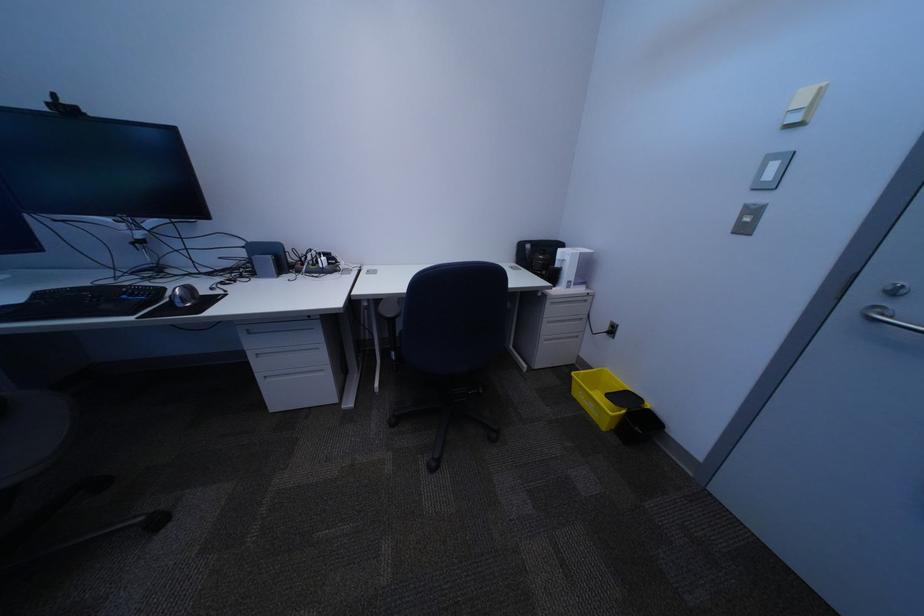
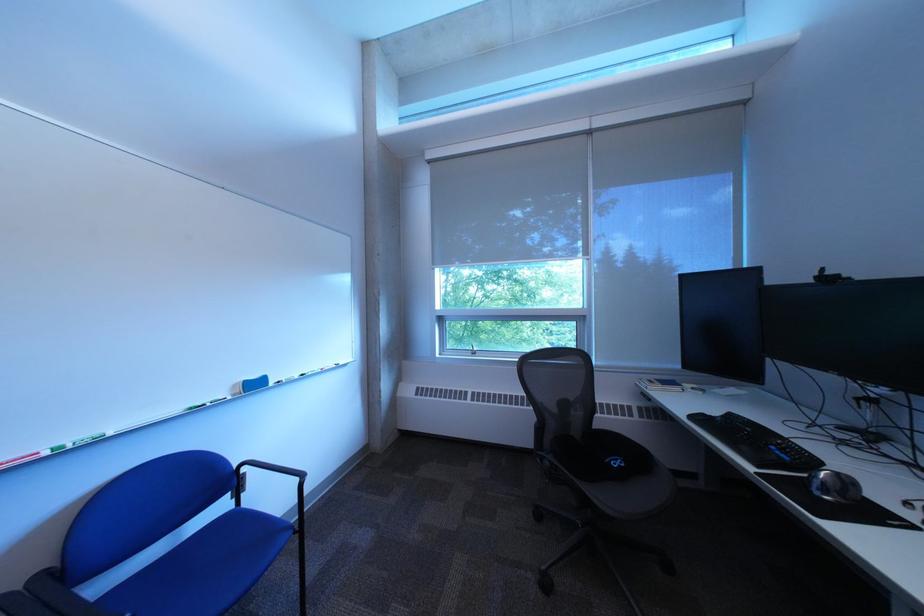
The point at (79, 103) is marked in the first image. Where is the corresponding point in the second image?

(843, 275)